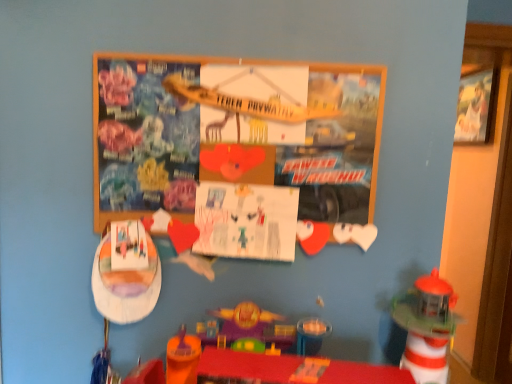
Question: From a real-world perspective, is white paper at center positioned under wooden picture frame at upper right based on gravity?

Choices:
 (A) yes
 (B) no

Answer: (A)

Question: Does white paper at center appear on the left side of wooden picture frame at upper right?

Choices:
 (A) no
 (B) yes

Answer: (B)

Question: Is white paper at center not close to wooden picture frame at upper right?

Choices:
 (A) yes
 (B) no

Answer: (A)

Question: Is white paper at center positioned behind wooden picture frame at upper right?

Choices:
 (A) yes
 (B) no

Answer: (B)

Question: Does white paper at center have a smaller size compared to wooden picture frame at upper right?

Choices:
 (A) yes
 (B) no

Answer: (A)

Question: Does white paper at center have a lesser height compared to wooden picture frame at upper right?

Choices:
 (A) yes
 (B) no

Answer: (A)

Question: From the image's perspective, is wooden bulletin board at center on top of wooden picture frame at upper right?

Choices:
 (A) yes
 (B) no

Answer: (B)

Question: Is wooden bulletin board at center wider than wooden picture frame at upper right?

Choices:
 (A) yes
 (B) no

Answer: (B)

Question: From a real-world perspective, is wooden bulletin board at center under wooden picture frame at upper right?

Choices:
 (A) no
 (B) yes

Answer: (B)

Question: Is the position of wooden bulletin board at center more distant than that of wooden picture frame at upper right?

Choices:
 (A) yes
 (B) no

Answer: (B)

Question: Considering the relative sizes of wooden bulletin board at center and wooden picture frame at upper right in the image provided, is wooden bulletin board at center shorter than wooden picture frame at upper right?

Choices:
 (A) yes
 (B) no

Answer: (A)

Question: Considering the relative sizes of wooden bulletin board at center and wooden picture frame at upper right in the image provided, is wooden bulletin board at center thinner than wooden picture frame at upper right?

Choices:
 (A) yes
 (B) no

Answer: (A)

Question: Is wooden bulletin board at center next to white paper at center and touching it?

Choices:
 (A) yes
 (B) no

Answer: (B)